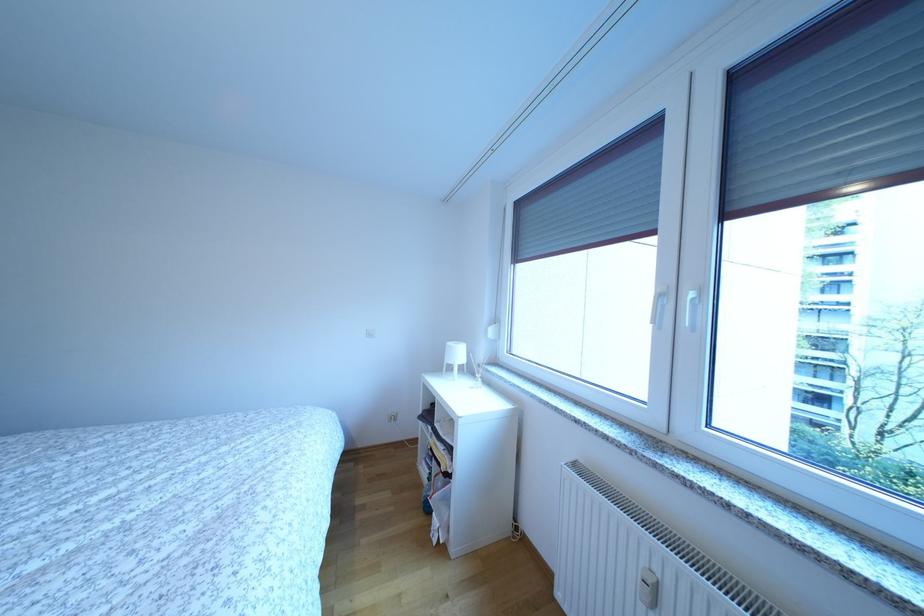
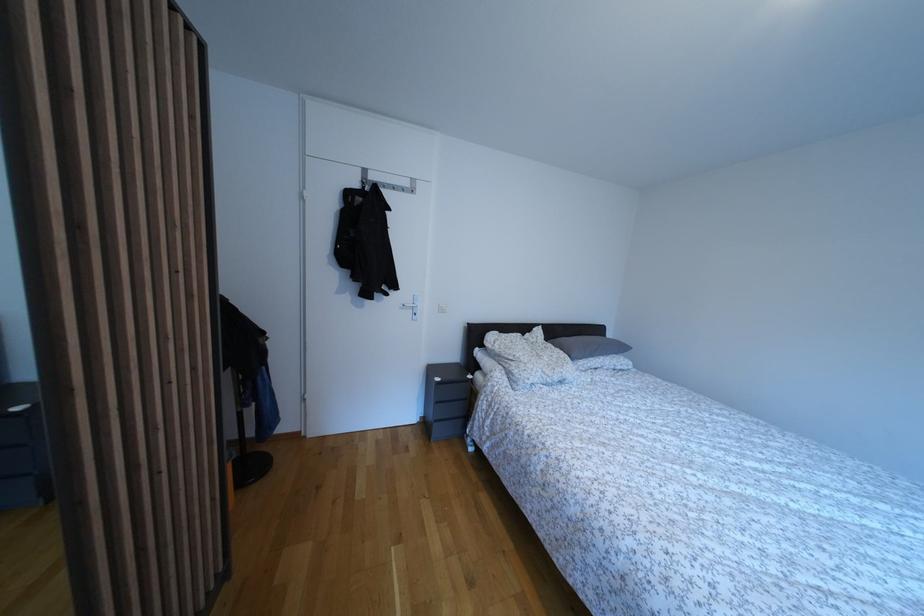
Question: How did the camera likely rotate?

Choices:
 (A) Left
 (B) Right
 (C) Up
 (D) Down

Answer: (A)